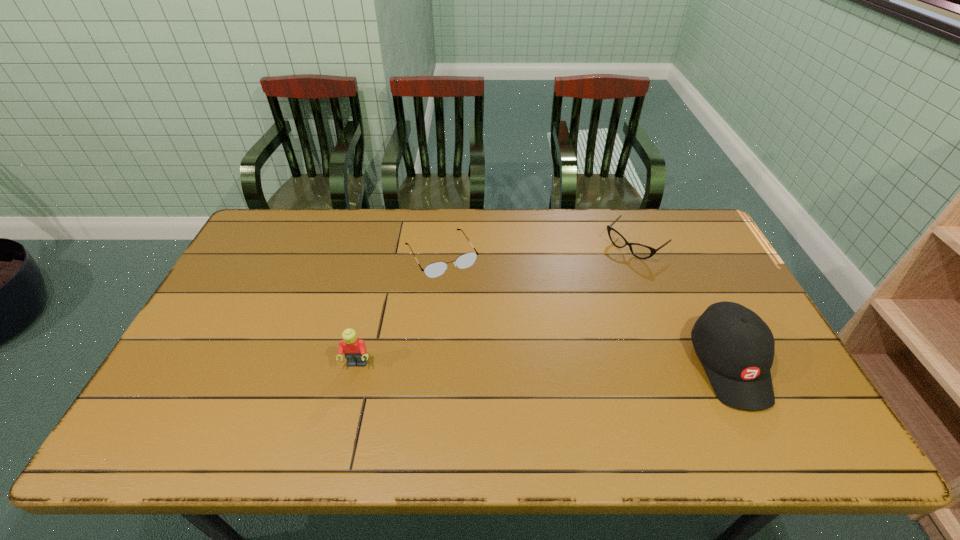
This screenshot has height=540, width=960. What are the coordinates of `vacant space positioned 0.290m on the front-facing side of the right spectacles` in the screenshot? It's located at (564, 306).

This screenshot has height=540, width=960. Find the location of `object present at the near edge`. object present at the near edge is located at coordinates (736, 347).

I want to click on object present at the right edge, so click(x=736, y=347).

Locate an element on the screen. object present at the near right corner is located at coordinates (736, 347).

Where is `vacant area at the far edge`? The image size is (960, 540). vacant area at the far edge is located at coordinates tap(383, 245).

Find the location of `vacant space at the near edge`. vacant space at the near edge is located at coordinates (533, 387).

At what (x,y) coordinates should I click in order to perform the action: click on vacant space at the left edge. Please return your answer as a coordinate pair (x, y). The height and width of the screenshot is (540, 960). Looking at the image, I should click on (246, 269).

In the image, there is a desktop. Find the location of `free space at the far left corner`. free space at the far left corner is located at coordinates (293, 228).

Where is `free space at the far right corner`? free space at the far right corner is located at coordinates (671, 226).

Find the location of `vacant space that's between the left spectacles and the right spectacles`. vacant space that's between the left spectacles and the right spectacles is located at coordinates tap(538, 251).